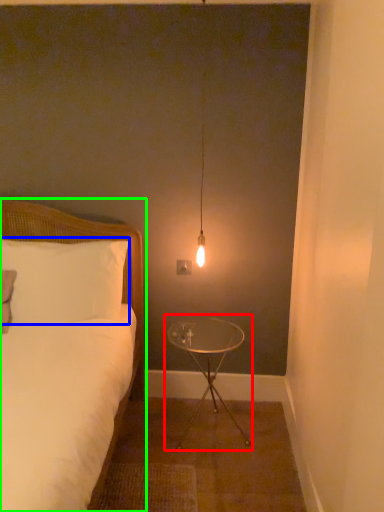
Question: Based on their relative distances, which object is nearer to table (highlighted by a red box)? Choose from pillow (highlighted by a blue box) and bed (highlighted by a green box).

Choices:
 (A) pillow
 (B) bed

Answer: (B)